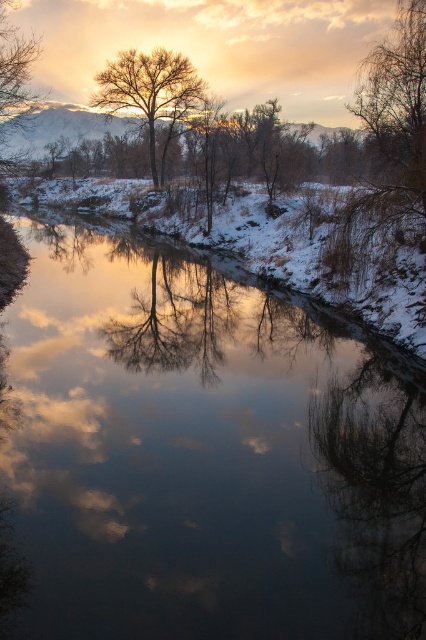
You are standing on the snow bank and see the smooth water at center and the bare branches tree at center. Which object is closer to the ground?

The smooth water at center is located below the bare branches tree at center, so the smooth water at center is closer to the ground.

You are standing at the riverbank and want to take a photo of the transparent glass trees at center and the bare branches at upper left. Which object is positioned lower in the image?

The transparent glass trees at center is located below the bare branches at upper left, so it is positioned lower in the image.